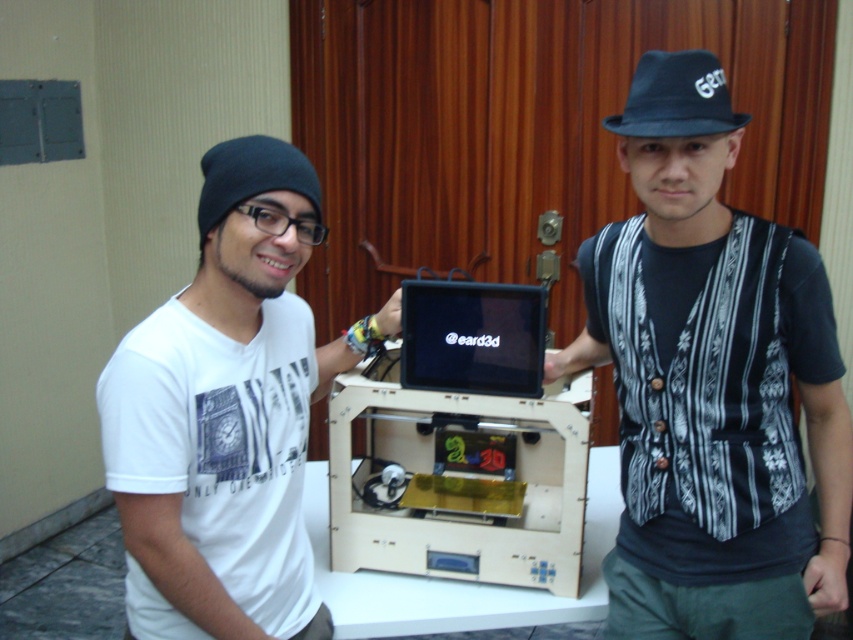
You are trying to locate your black knit beanie at left and matte black laptop at center in the image. Based on their positions, which object is closer to the left edge of the image?

The black knit beanie at left is closer to the left edge of the image because the matte black laptop at center is positioned to its right side.

You are trying to locate your belongings in the image. You have a matte black laptop and a black knit beanie. According to the scene, where is the matte black laptop at center relative to the black knit beanie at left?

The matte black laptop at center is located below the black knit beanie at left.